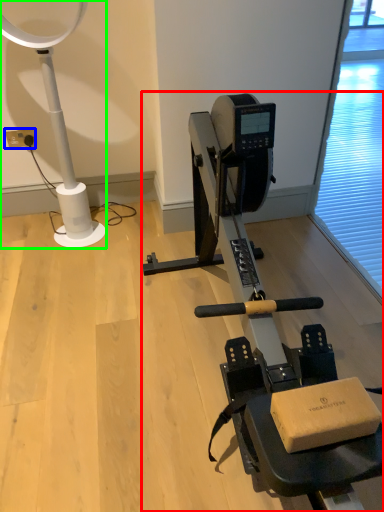
Question: Which is farther away from stationary bicycle (highlighted by a red box)? electric outlet (highlighted by a blue box) or lamp (highlighted by a green box)?

Choices:
 (A) electric outlet
 (B) lamp

Answer: (A)